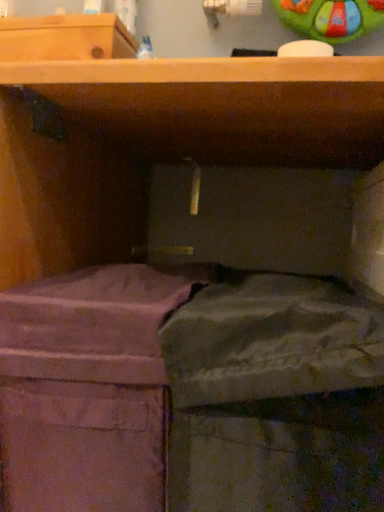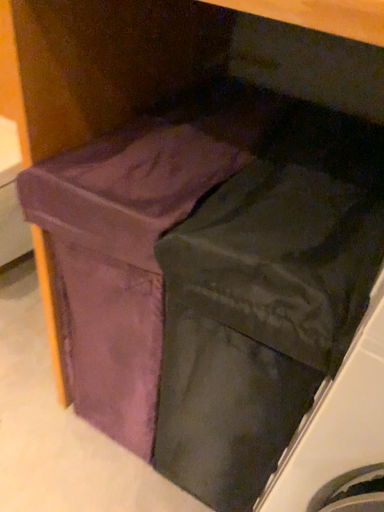
Question: How did the camera likely rotate when shooting the video?

Choices:
 (A) rotated left
 (B) rotated right

Answer: (A)